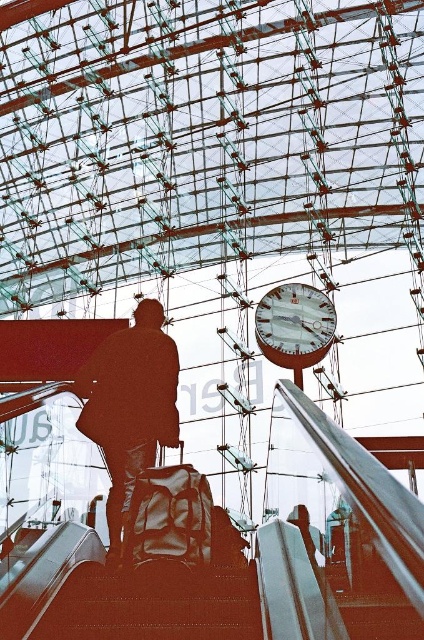
You are a delivery robot carrying a package that is 6 meters long. You need to navigate through the train station shown in the image. There are shiny metallic stairs at lower center and a silhouette fabric bag at center. Can your package fit between these two objects without bending?

The distance between the shiny metallic stairs at lower center and the silhouette fabric bag at center is 5.91 meters. Since your package is 6 meters long, it cannot fit between them without bending.

You are standing at the entrance of the train station and want to check the time on the metallic silver clock at upper center. However, you notice the shiny metallic stairs at lower center might block your view. Can you see the clock over the stairs?

The shiny metallic stairs at lower center are not as tall as the metallic silver clock at upper center, so yes, you can see the clock over the stairs since it is taller than the stairs.